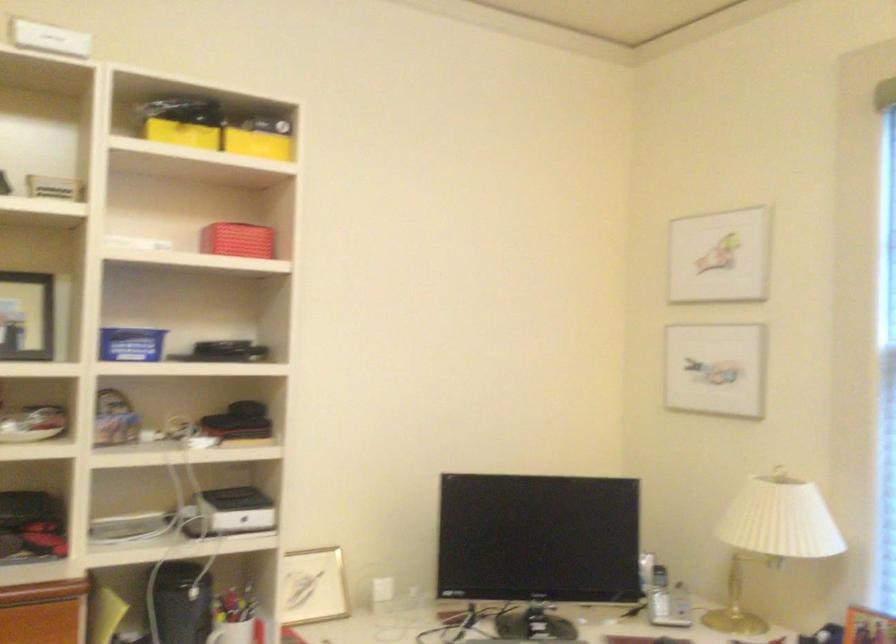
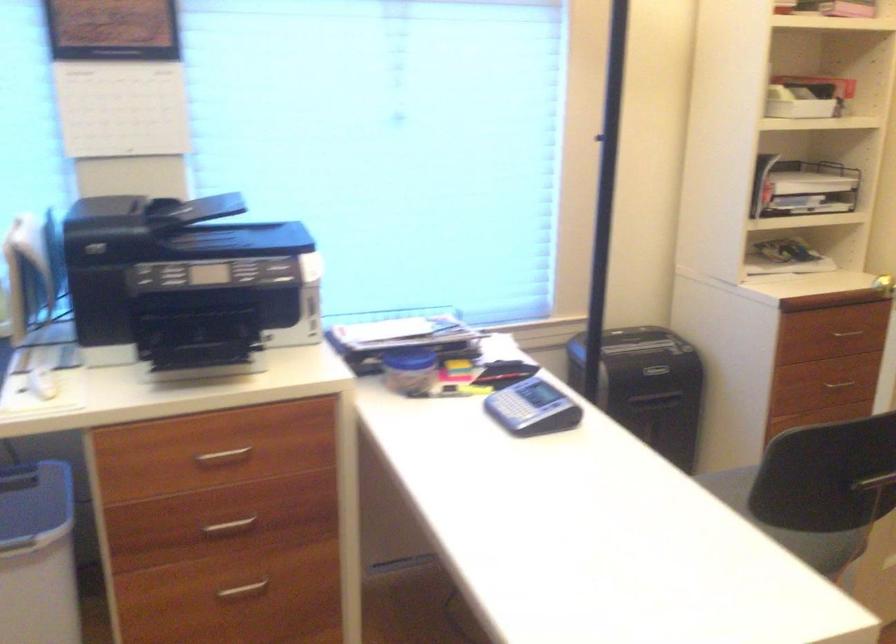
Looking at this image, the images are taken continuously from a first-person perspective. In which direction is your viewpoint rotating?

The rotation direction of the camera is right-down.